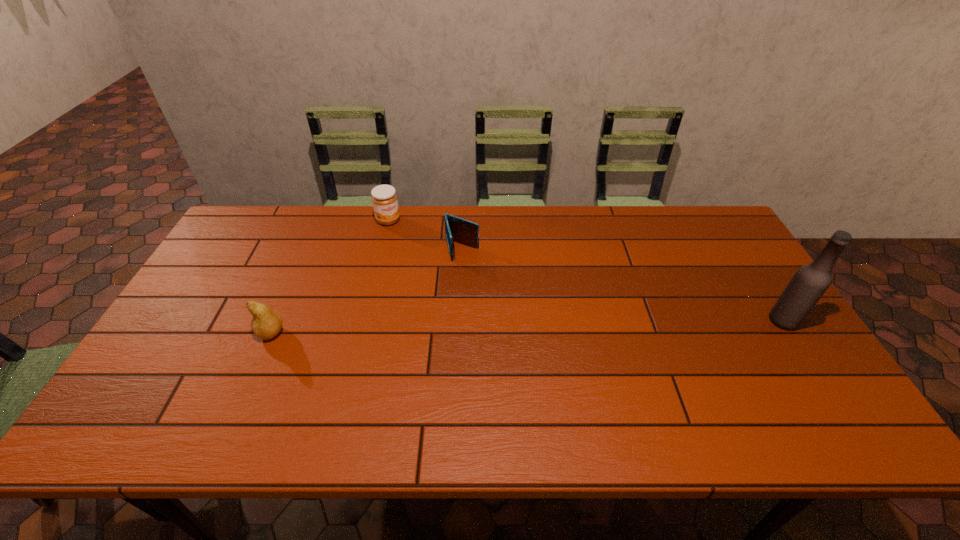
At what (x,y) coordinates should I click in order to perform the action: click on free space located on the exterior surface of the wallet. Please return your answer as a coordinate pair (x, y). This screenshot has width=960, height=540. Looking at the image, I should click on (476, 303).

Locate an element on the screen. free space located 0.210m on the front label of the farthest object is located at coordinates (420, 262).

The width and height of the screenshot is (960, 540). What are the coordinates of `vacant area located 0.220m on the front label of the farthest object` in the screenshot? It's located at (420, 264).

Locate an element on the screen. vacant space situated 0.350m on the front label of the farthest object is located at coordinates (440, 289).

Where is `wallet located at the far edge`? wallet located at the far edge is located at coordinates (457, 229).

Locate an element on the screen. The image size is (960, 540). jam that is at the far edge is located at coordinates (384, 198).

At what (x,y) coordinates should I click in order to perform the action: click on object located at the right edge. Please return your answer as a coordinate pair (x, y). This screenshot has height=540, width=960. Looking at the image, I should click on click(x=810, y=282).

The height and width of the screenshot is (540, 960). In the image, there is a desktop. Find the location of `vacant region at the far edge`. vacant region at the far edge is located at coordinates (563, 211).

I want to click on vacant space at the left edge of the desktop, so click(x=209, y=352).

In the image, there is a desktop. Find the location of `blank space at the right edge`. blank space at the right edge is located at coordinates (743, 335).